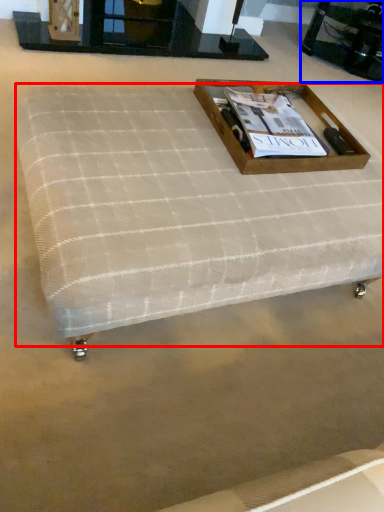
Question: Which point is further to the camera, mattress (highlighted by a red box) or round table (highlighted by a blue box)?

Choices:
 (A) mattress
 (B) round table

Answer: (B)